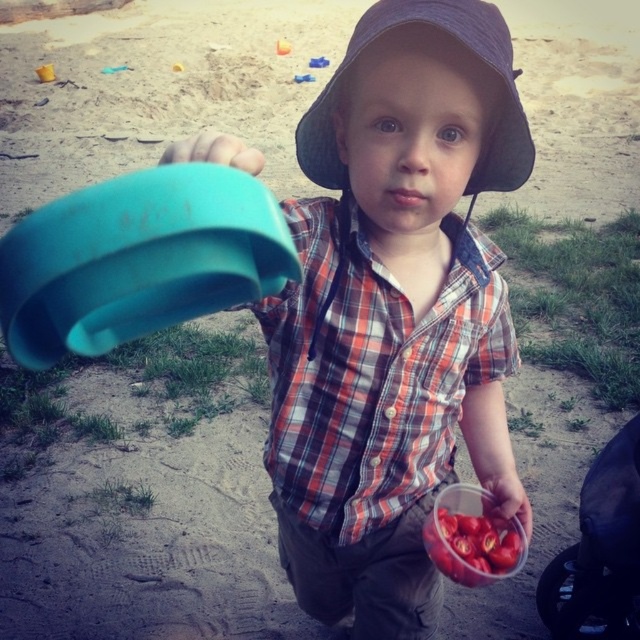
Which of these two, plaid cotton shirt at center or teal plastic cup at upper left, stands shorter?

With less height is teal plastic cup at upper left.

Who is more forward, (326,246) or (244,156)?

Point (244,156) is in front.

Where is `plaid cotton shirt at center`? plaid cotton shirt at center is located at coordinates (372, 372).

Between matte plastic bucket at upper left and teal plastic cup at upper left, which one is positioned lower?

Positioned lower is matte plastic bucket at upper left.

Can you confirm if matte plastic bucket at upper left is bigger than teal plastic cup at upper left?

Yes, matte plastic bucket at upper left is bigger than teal plastic cup at upper left.

The width and height of the screenshot is (640, 640). Find the location of `matte plastic bucket at upper left`. matte plastic bucket at upper left is located at coordinates (394, 310).

Does matte plastic bucket at upper left appear on the left side of dark blue fabric hat at center?

Yes, matte plastic bucket at upper left is to the left of dark blue fabric hat at center.

Does matte plastic bucket at upper left appear under dark blue fabric hat at center?

Indeed, matte plastic bucket at upper left is positioned under dark blue fabric hat at center.

This screenshot has height=640, width=640. Describe the element at coordinates (394, 310) in the screenshot. I see `matte plastic bucket at upper left` at that location.

Find the location of a particular element. The height and width of the screenshot is (640, 640). matte plastic bucket at upper left is located at coordinates (394, 310).